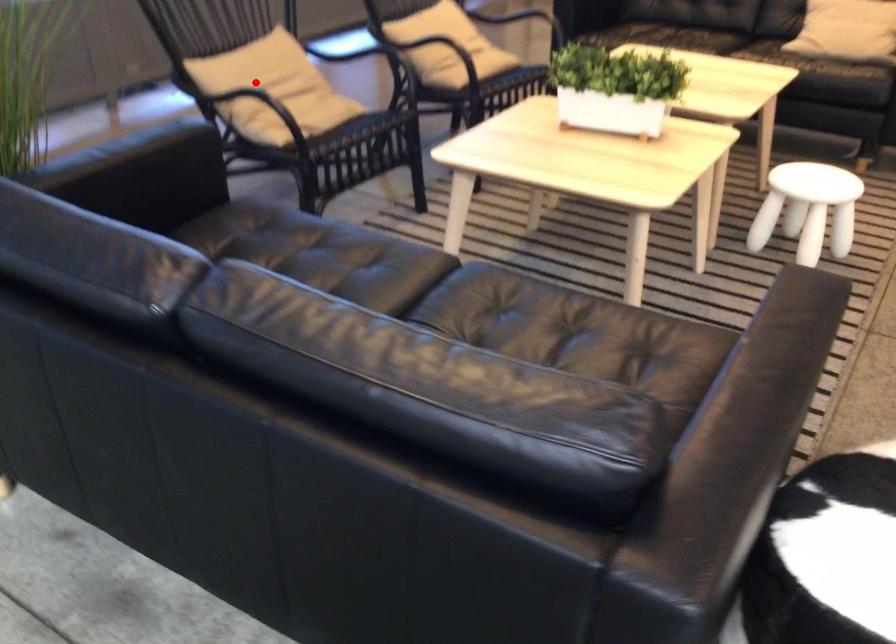
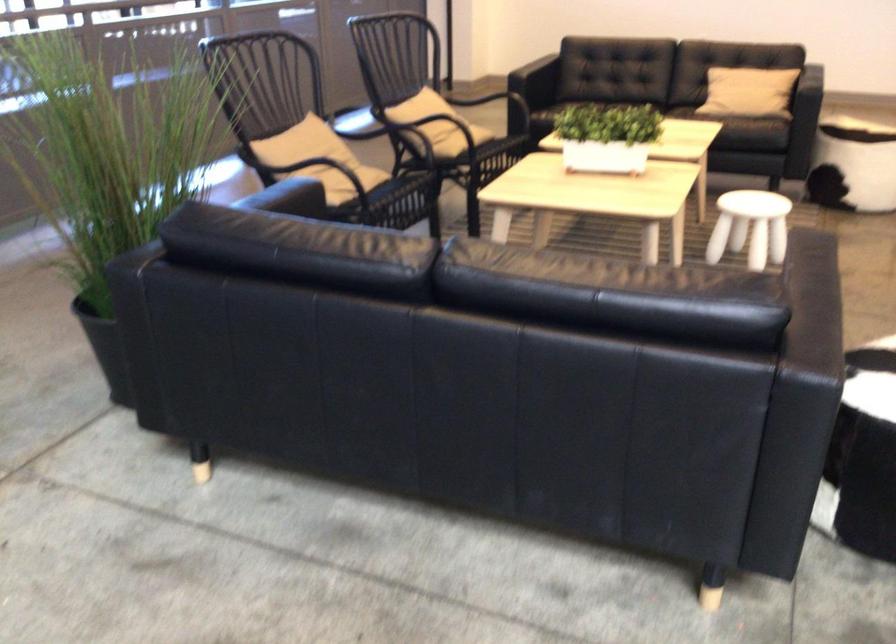
Question: I am providing you with two images of the same scene from different viewpoints. A red point is shown in image1. For the corresponding object point in image2, is it positioned nearer or farther from the camera?

Choices:
 (A) Nearer
 (B) Farther

Answer: (B)